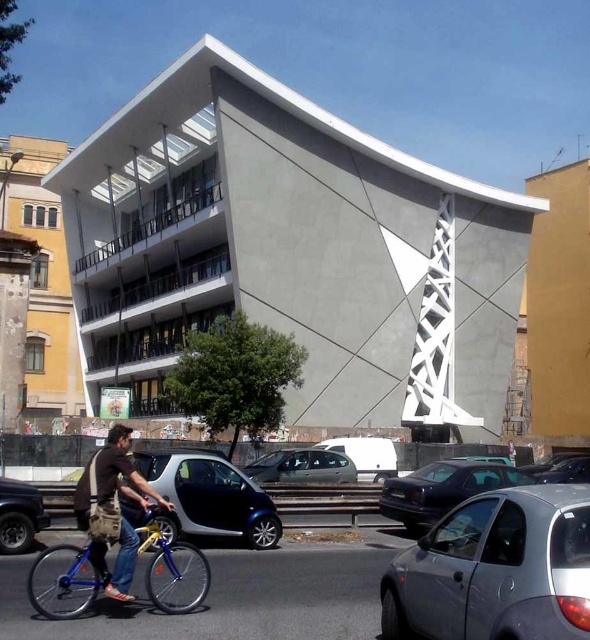
Question: Which of the following is the farthest from the observer?

Choices:
 (A) (529, 548)
 (B) (145, 476)
 (C) (96, 556)
 (D) (260, 458)

Answer: (D)

Question: Among these objects, which one is nearest to the camera?

Choices:
 (A) black matte truck at lower left
 (B) metallic gray hatchback at lower right

Answer: (B)

Question: From the image, what is the correct spatial relationship of blue metallic bicycle at lower left in relation to dark gray metallic car at center?

Choices:
 (A) below
 (B) above

Answer: (B)

Question: Considering the real-world distances, which object is closest to the metallic blue car at center?

Choices:
 (A) black matte truck at lower left
 (B) metallic gray hatchback at lower right

Answer: (A)

Question: Is metallic blue car at center smaller than blue metallic bicycle at lower left?

Choices:
 (A) no
 (B) yes

Answer: (B)

Question: Is metallic gray hatchback at lower right below denim pants at lower left?

Choices:
 (A) yes
 (B) no

Answer: (B)